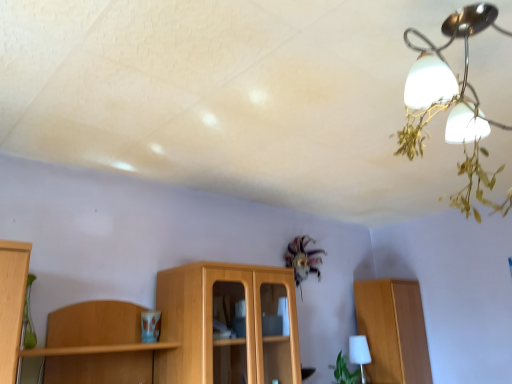
Question: Considering the relative sizes of white matte table lamp at lower right and satin silver chandelier at upper right in the image provided, is white matte table lamp at lower right shorter than satin silver chandelier at upper right?

Choices:
 (A) no
 (B) yes

Answer: (B)

Question: Can you confirm if white matte table lamp at lower right is bigger than satin silver chandelier at upper right?

Choices:
 (A) no
 (B) yes

Answer: (A)

Question: Could you tell me if white matte table lamp at lower right is facing satin silver chandelier at upper right?

Choices:
 (A) no
 (B) yes

Answer: (A)

Question: Considering the relative positions of white matte table lamp at lower right and satin silver chandelier at upper right in the image provided, is white matte table lamp at lower right to the right of satin silver chandelier at upper right from the viewer's perspective?

Choices:
 (A) no
 (B) yes

Answer: (B)

Question: Can you confirm if white matte table lamp at lower right is taller than satin silver chandelier at upper right?

Choices:
 (A) yes
 (B) no

Answer: (B)

Question: Considering the positions of green leafy plant at lower right and white matte table lamp at lower right in the image, is green leafy plant at lower right bigger or smaller than white matte table lamp at lower right?

Choices:
 (A) small
 (B) big

Answer: (B)

Question: Which is correct: green leafy plant at lower right is inside white matte table lamp at lower right, or outside of it?

Choices:
 (A) inside
 (B) outside

Answer: (B)

Question: Based on their positions, is green leafy plant at lower right located to the left or right of white matte table lamp at lower right?

Choices:
 (A) right
 (B) left

Answer: (B)

Question: Is green leafy plant at lower right in front of or behind white matte table lamp at lower right in the image?

Choices:
 (A) front
 (B) behind

Answer: (A)

Question: From the image's perspective, relative to white matte table lamp at lower right, is satin silver chandelier at upper right above or below?

Choices:
 (A) above
 (B) below

Answer: (A)

Question: Is point (406, 43) positioned closer to the camera than point (353, 360)?

Choices:
 (A) farther
 (B) closer

Answer: (B)

Question: From a real-world perspective, is satin silver chandelier at upper right physically located above or below white matte table lamp at lower right?

Choices:
 (A) below
 (B) above

Answer: (B)

Question: Is satin silver chandelier at upper right inside the boundaries of white matte table lamp at lower right, or outside?

Choices:
 (A) inside
 (B) outside

Answer: (B)

Question: Looking at the image, does wooden cabinet at right seem bigger or smaller compared to green leafy plant at lower right?

Choices:
 (A) small
 (B) big

Answer: (B)

Question: Is wooden cabinet at right in front of or behind green leafy plant at lower right in the image?

Choices:
 (A) front
 (B) behind

Answer: (B)